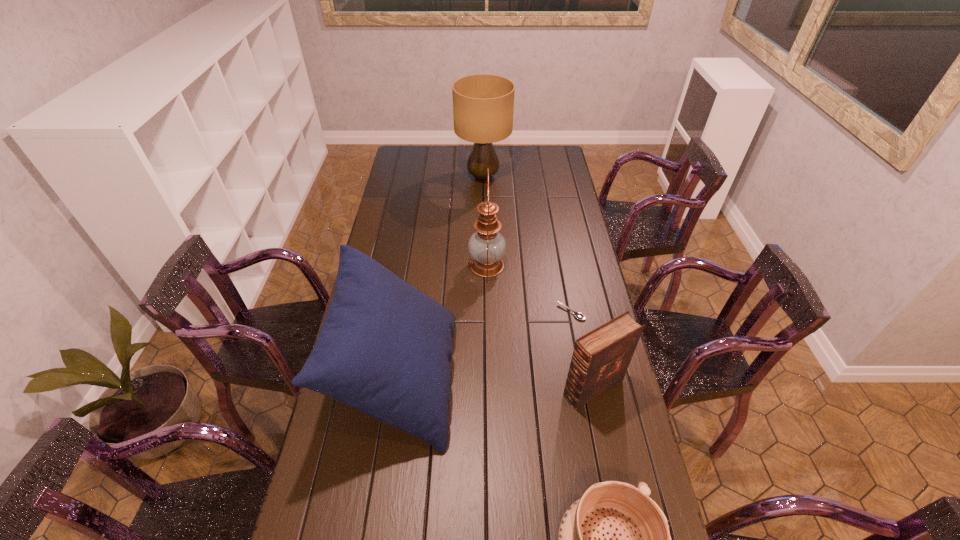
Where is `lampshade`? The height and width of the screenshot is (540, 960). lampshade is located at coordinates (483, 104).

Locate an element on the screen. the second farthest object is located at coordinates (487, 246).

Find the location of `the fourth shortest object`. the fourth shortest object is located at coordinates click(384, 348).

Locate an element on the screen. Image resolution: width=960 pixels, height=540 pixels. the third shortest object is located at coordinates (600, 359).

This screenshot has height=540, width=960. I want to click on soupspoon, so click(578, 315).

Locate an element on the screen. The height and width of the screenshot is (540, 960). free space located 0.100m on the back of the farthest object is located at coordinates (483, 153).

Identify the location of blank space located 0.060m on the right of the oil lamp. (521, 265).

Where is `vacant space located on the facing side of the fourth shortest object`? The width and height of the screenshot is (960, 540). vacant space located on the facing side of the fourth shortest object is located at coordinates (538, 378).

In order to click on vacant space situated on the left of the third shortest object in this screenshot , I will do `click(535, 388)`.

Where is `vacant space located 0.210m on the front of the shortest object`? vacant space located 0.210m on the front of the shortest object is located at coordinates (583, 374).